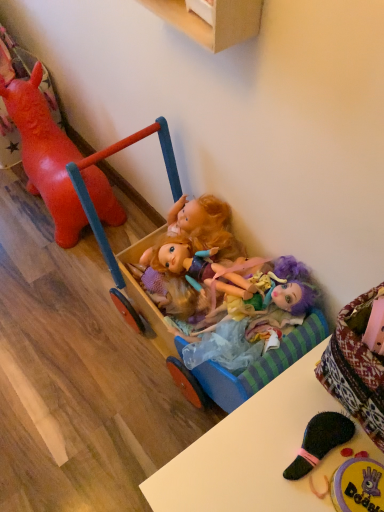
Identify the location of white glossy table at lower right. This screenshot has height=512, width=384. (249, 452).

Where is `plush purple doll at lower right, the 2th toy from the top`? Image resolution: width=384 pixels, height=512 pixels. plush purple doll at lower right, the 2th toy from the top is located at coordinates (358, 486).

Where is `white glossy table at lower right`? white glossy table at lower right is located at coordinates (249, 452).

From a real-world perspective, is glossy plastic horse at left, the second toy in the front-to-back sequence, physically located above or below plush purple doll at lower right, the 2th toy from the top?

glossy plastic horse at left, the second toy in the front-to-back sequence, is below plush purple doll at lower right, the 2th toy from the top.

Does glossy plastic horse at left, which is counted as the 1th toy, starting from the top, contain plush purple doll at lower right, acting as the first toy starting from the bottom?

No, glossy plastic horse at left, which is counted as the 1th toy, starting from the top, does not contain plush purple doll at lower right, acting as the first toy starting from the bottom.

From the image's perspective, which is above, glossy plastic horse at left, acting as the 1th toy starting from the left, or plush purple doll at lower right, acting as the 2th toy starting from the left?

glossy plastic horse at left, acting as the 1th toy starting from the left, appears higher in the image.

Can we say wooden toy carriage at center lies outside wooden cabinet at upper center?

wooden toy carriage at center is positioned outside wooden cabinet at upper center.

Is point (126, 310) more distant than point (178, 22)?

Yes, it is behind point (178, 22).

From the picture: From the image's perspective, is wooden toy carriage at center on top of wooden cabinet at upper center?

No.

Where is `cabinetry lying on the left of wooden toy carriage at center`? The height and width of the screenshot is (512, 384). cabinetry lying on the left of wooden toy carriage at center is located at coordinates (215, 21).

Can you confirm if plush purple doll at lower right, acting as the 2th toy starting from the left, is smaller than white glossy table at lower right?

Indeed, plush purple doll at lower right, acting as the 2th toy starting from the left, has a smaller size compared to white glossy table at lower right.

Which object is positioned more to the right, plush purple doll at lower right, the 2th toy from the top, or white glossy table at lower right?

plush purple doll at lower right, the 2th toy from the top, is more to the right.

From the image's perspective, which object appears higher, plush purple doll at lower right, which ranks as the 2th toy in back-to-front order, or white glossy table at lower right?

plush purple doll at lower right, which ranks as the 2th toy in back-to-front order.

Consider the image. How many degrees apart are the facing directions of plush purple doll at lower right, which ranks as the 2th toy in back-to-front order, and white glossy table at lower right?

plush purple doll at lower right, which ranks as the 2th toy in back-to-front order, and white glossy table at lower right are facing 0.00195 degrees away from each other.

Does point (221, 379) come closer to viewer compared to point (31, 154)?

Yes, it is in front of point (31, 154).

Looking at this image, is wooden toy carriage at center positioned beyond the bounds of glossy plastic horse at left, the second toy in the front-to-back sequence?

Yes, wooden toy carriage at center is not within glossy plastic horse at left, the second toy in the front-to-back sequence.

Consider the image. Between wooden toy carriage at center and glossy plastic horse at left, acting as the 1th toy starting from the left, which one has less height?

glossy plastic horse at left, acting as the 1th toy starting from the left.

Considering the relative sizes of wooden toy carriage at center and glossy plastic horse at left, which is counted as the 1th toy, starting from the top, in the image provided, is wooden toy carriage at center bigger than glossy plastic horse at left, which is counted as the 1th toy, starting from the top,?

Indeed, wooden toy carriage at center has a larger size compared to glossy plastic horse at left, which is counted as the 1th toy, starting from the top.

Which of these two, glossy plastic horse at left, acting as the 1th toy starting from the left, or multicolored fabric dolls at center, stands taller?

With more height is glossy plastic horse at left, acting as the 1th toy starting from the left.

Considering the positions of point (37, 136) and point (238, 313), is point (37, 136) closer or farther from the camera than point (238, 313)?

Point (37, 136) is farther from the camera than point (238, 313).

From a real-world perspective, is glossy plastic horse at left, placed as the 1th toy when sorted from back to front, physically located above or below multicolored fabric dolls at center?

glossy plastic horse at left, placed as the 1th toy when sorted from back to front, is situated lower than multicolored fabric dolls at center in the real world.

Which object is closer to the camera taking this photo, glossy plastic horse at left, the second toy when ordered from bottom to top, or multicolored fabric dolls at center?

Positioned in front is multicolored fabric dolls at center.

From a real-world perspective, between wooden cabinet at upper center and multicolored fabric dolls at center, who is vertically lower?

multicolored fabric dolls at center, from a real-world perspective.

From the image's perspective, would you say wooden cabinet at upper center is positioned over multicolored fabric dolls at center?

Correct, wooden cabinet at upper center appears higher than multicolored fabric dolls at center in the image.

Measure the distance between wooden cabinet at upper center and multicolored fabric dolls at center.

wooden cabinet at upper center is 21.59 inches from multicolored fabric dolls at center.

Between wooden cabinet at upper center and multicolored fabric dolls at center, which one has smaller width?

wooden cabinet at upper center.

Is the surface of glossy plastic horse at left, which is counted as the 1th toy, starting from the top, in direct contact with wooden cabinet at upper center?

glossy plastic horse at left, which is counted as the 1th toy, starting from the top, and wooden cabinet at upper center are not in contact.

From the image's perspective, between glossy plastic horse at left, the second toy in the front-to-back sequence, and wooden cabinet at upper center, who is located below?

From the image's view, glossy plastic horse at left, the second toy in the front-to-back sequence, is below.

Does glossy plastic horse at left, the second toy positioned from the right, come behind wooden cabinet at upper center?

Yes, glossy plastic horse at left, the second toy positioned from the right, is behind wooden cabinet at upper center.

In order to click on toy that is above the plush purple doll at lower right, acting as the first toy starting from the bottom (from the image's perspective) in this screenshot , I will do `click(45, 155)`.

Locate an element on the screen. This screenshot has height=512, width=384. cabinetry in front of the wooden toy carriage at center is located at coordinates (215, 21).

Looking at the image, which one is located closer to wooden toy carriage at center, multicolored fabric dolls at center or glossy plastic horse at left, which is counted as the 1th toy, starting from the top?

multicolored fabric dolls at center lies closer to wooden toy carriage at center than the other object.

Looking at the image, which one is located further to wooden toy carriage at center, wooden cabinet at upper center or white glossy table at lower right?

The object further to wooden toy carriage at center is wooden cabinet at upper center.

Based on their spatial positions, is plush purple doll at lower right, acting as the first toy starting from the bottom, or wooden toy carriage at center closer to glossy plastic horse at left, placed as the 1th toy when sorted from back to front?

Based on the image, wooden toy carriage at center appears to be nearer to glossy plastic horse at left, placed as the 1th toy when sorted from back to front.

Estimate the real-world distances between objects in this image. Which object is closer to wooden toy carriage at center, white glossy table at lower right or wooden cabinet at upper center?

white glossy table at lower right lies closer to wooden toy carriage at center than the other object.

Based on their spatial positions, is white glossy table at lower right or wooden toy carriage at center closer to wooden cabinet at upper center?

The object closer to wooden cabinet at upper center is wooden toy carriage at center.

Which object lies nearer to the anchor point wooden cabinet at upper center, wooden toy carriage at center or white glossy table at lower right?

The object closer to wooden cabinet at upper center is wooden toy carriage at center.

Looking at the image, which one is located further to wooden cabinet at upper center, wooden toy carriage at center or multicolored fabric dolls at center?

multicolored fabric dolls at center.

Looking at the image, which one is located further to white glossy table at lower right, glossy plastic horse at left, placed as the 1th toy when sorted from back to front, or wooden cabinet at upper center?

glossy plastic horse at left, placed as the 1th toy when sorted from back to front, is further to white glossy table at lower right.

Identify the location of baby carriage between glossy plastic horse at left, the second toy when ordered from bottom to top, and plush purple doll at lower right, acting as the 2th toy starting from the left, from left to right. This screenshot has width=384, height=512. (107, 255).

The height and width of the screenshot is (512, 384). Identify the location of baby carriage between wooden cabinet at upper center and white glossy table at lower right vertically. (107, 255).

Image resolution: width=384 pixels, height=512 pixels. What are the coordinates of `doll situated between glossy plastic horse at left, the second toy in the front-to-back sequence, and white glossy table at lower right from left to right` in the screenshot? It's located at (254, 320).

Where is `doll between wooden cabinet at upper center and white glossy table at lower right from top to bottom`? Image resolution: width=384 pixels, height=512 pixels. doll between wooden cabinet at upper center and white glossy table at lower right from top to bottom is located at coordinates (254, 320).